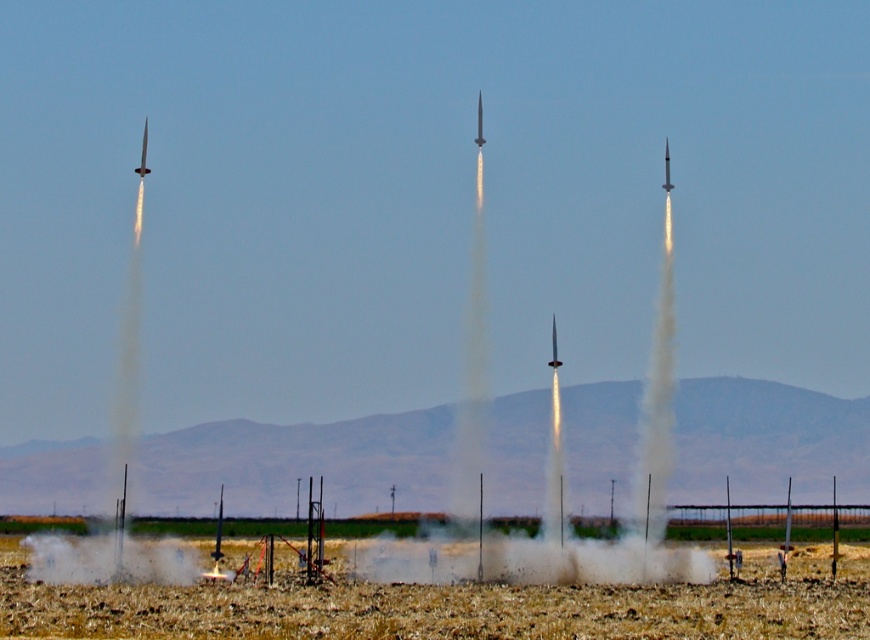
Consider the image. You are a safety officer at the rocket launch site. You need to ensure that all rockets are at least 20 meters apart for safety. Are the white vapor rocket at center and the matte silver rocket at center compliant with the safety distance requirement?

The distance between the white vapor rocket at center and the matte silver rocket at center is 16.86 meters, which is less than the required 20 meters. Therefore, they are not compliant with the safety distance requirement.

You are a photographer trying to capture the rocket launch. You want to focus on the rocket at point (165,570) and the one at point (474,140). Which rocket is closer to the camera?

Point (165,570) is closer to the camera than point (474,140).